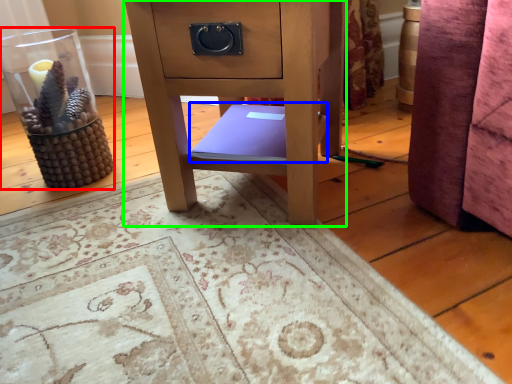
Question: Which object is positioned closest to glass vase (highlighted by a red box)? Select from book (highlighted by a blue box) and furniture (highlighted by a green box).

Choices:
 (A) book
 (B) furniture

Answer: (A)